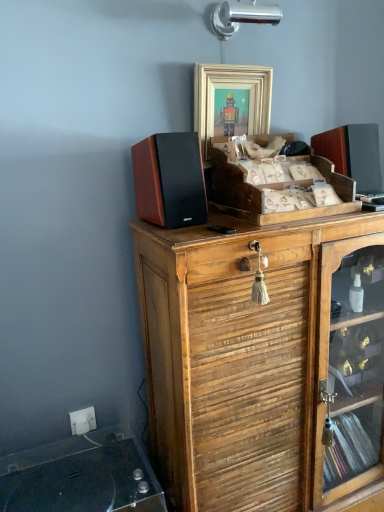
Question: Can you confirm if wooden crate at center, placed as the 2th cabinetry when sorted from bottom to top, is shorter than white plastic electric outlet at lower left?

Choices:
 (A) yes
 (B) no

Answer: (B)

Question: Is wooden crate at center, placed as the 2th cabinetry when sorted from bottom to top, not inside white plastic electric outlet at lower left?

Choices:
 (A) no
 (B) yes

Answer: (B)

Question: Is wooden crate at center, placed as the first cabinetry when sorted from top to bottom, at the right side of white plastic electric outlet at lower left?

Choices:
 (A) yes
 (B) no

Answer: (A)

Question: Are wooden crate at center, placed as the 2th cabinetry when sorted from bottom to top, and white plastic electric outlet at lower left far apart?

Choices:
 (A) yes
 (B) no

Answer: (B)

Question: Is white plastic electric outlet at lower left at the back of wooden crate at center, placed as the 2th cabinetry when sorted from bottom to top?

Choices:
 (A) no
 (B) yes

Answer: (A)

Question: Would you say wooden crate at center, placed as the 2th cabinetry when sorted from bottom to top, contains white plastic electric outlet at lower left?

Choices:
 (A) yes
 (B) no

Answer: (B)

Question: Is white plastic electric outlet at lower left placed right next to wooden crate at center, placed as the first cabinetry when sorted from top to bottom?

Choices:
 (A) no
 (B) yes

Answer: (A)

Question: Is white plastic electric outlet at lower left turned away from wooden crate at center, placed as the 2th cabinetry when sorted from bottom to top?

Choices:
 (A) no
 (B) yes

Answer: (A)

Question: Is white plastic electric outlet at lower left taller than wooden crate at center, placed as the 2th cabinetry when sorted from bottom to top?

Choices:
 (A) no
 (B) yes

Answer: (A)

Question: From a real-world perspective, is white plastic electric outlet at lower left positioned over wooden crate at center, placed as the first cabinetry when sorted from top to bottom, based on gravity?

Choices:
 (A) no
 (B) yes

Answer: (A)

Question: Is there a large distance between white plastic electric outlet at lower left and wooden crate at center, placed as the 2th cabinetry when sorted from bottom to top?

Choices:
 (A) no
 (B) yes

Answer: (A)

Question: Is the depth of white plastic electric outlet at lower left greater than that of wooden crate at center, placed as the 2th cabinetry when sorted from bottom to top?

Choices:
 (A) yes
 (B) no

Answer: (A)

Question: Considering the relative positions of clear glass record player at lower left and white plastic electric outlet at lower left in the image provided, is clear glass record player at lower left to the left of white plastic electric outlet at lower left from the viewer's perspective?

Choices:
 (A) no
 (B) yes

Answer: (A)